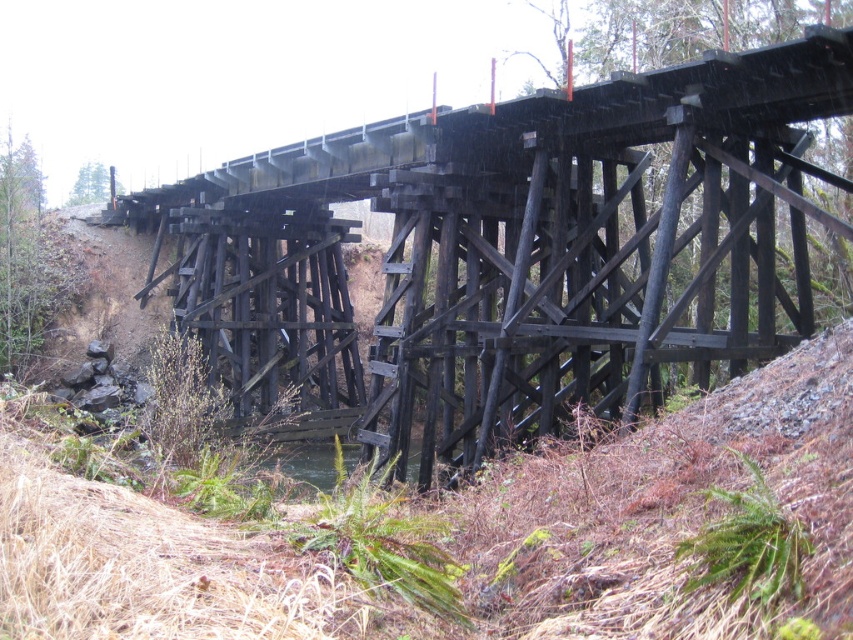
Between green leafy tree at upper left and green matte tree at upper left, which one appears on the left side from the viewer's perspective?

green leafy tree at upper left is more to the left.

What do you see at coordinates (20, 177) in the screenshot? I see `green leafy tree at upper left` at bounding box center [20, 177].

I want to click on green leafy tree at upper left, so click(20, 177).

The image size is (853, 640). Describe the element at coordinates (524, 246) in the screenshot. I see `black wood bridge at center` at that location.

Between black wood bridge at center and green fuzzy fern at lower right, which one is positioned higher?

black wood bridge at center

Is point (389, 333) positioned before point (752, 515)?

No, (389, 333) is behind (752, 515).

Locate an element on the screen. This screenshot has width=853, height=640. black wood bridge at center is located at coordinates (524, 246).

Is black wood bridge at center smaller than green leafy plant at lower center?

No.

Is black wood bridge at center in front of green leafy plant at lower center?

That is False.

At what (x,y) coordinates should I click in order to perform the action: click on black wood bridge at center. Please return your answer as a coordinate pair (x, y). The width and height of the screenshot is (853, 640). Looking at the image, I should click on point(524,246).